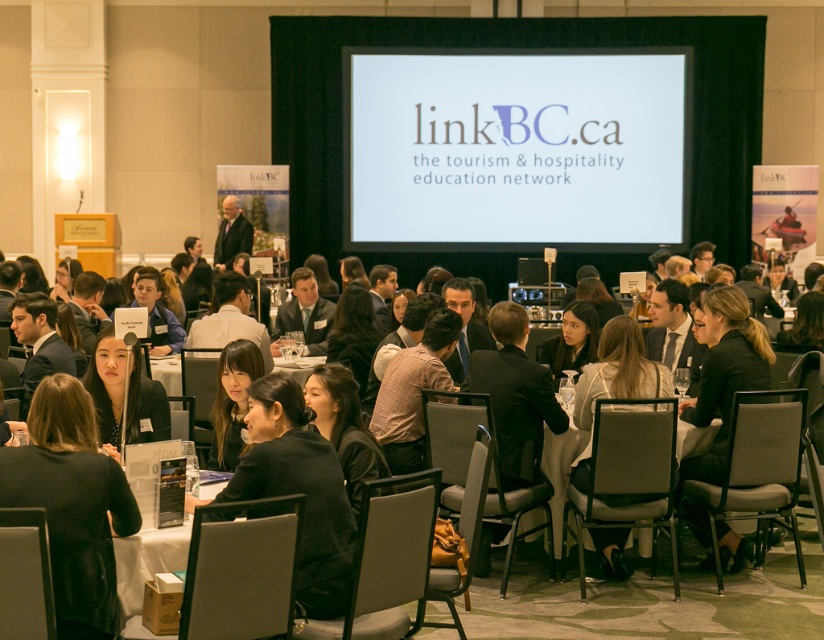
Between point (241, 468) and point (160, 550), which one is positioned in front?

Point (241, 468) is more forward.

Is point (244, 483) closer to camera compared to point (204, 486)?

That is True.

Which is in front, point (347, 544) or point (134, 588)?

Point (134, 588) is in front.

Locate an element on the screen. black fabric jacket at center is located at coordinates (298, 490).

Does matte black hair at center have a smaller size compared to white plastic chair at lower center?

No.

Between matte black hair at center and white plastic chair at lower center, which one has more height?

white plastic chair at lower center

Between point (103, 356) and point (559, 451), which one is positioned in front?

Point (103, 356) is in front.

Where is `matte black hair at center`? matte black hair at center is located at coordinates (106, 387).

Is black leather jacket at lower right bigger than white plastic chair at lower center?

Yes, black leather jacket at lower right is bigger than white plastic chair at lower center.

Who is more distant from viewer, (724, 529) or (541, 464)?

Point (724, 529)

Find the location of a particular element. The width and height of the screenshot is (824, 640). black leather jacket at lower right is located at coordinates (724, 374).